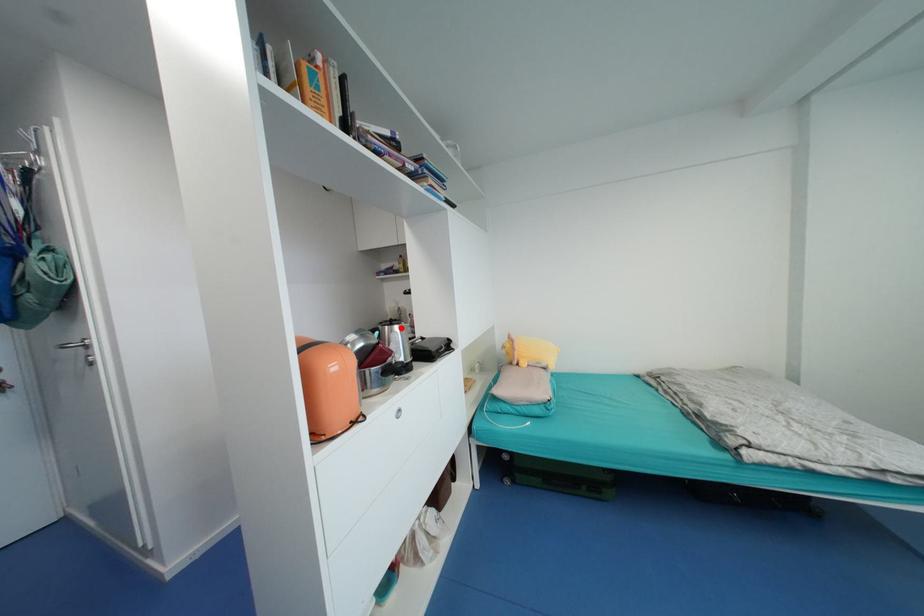
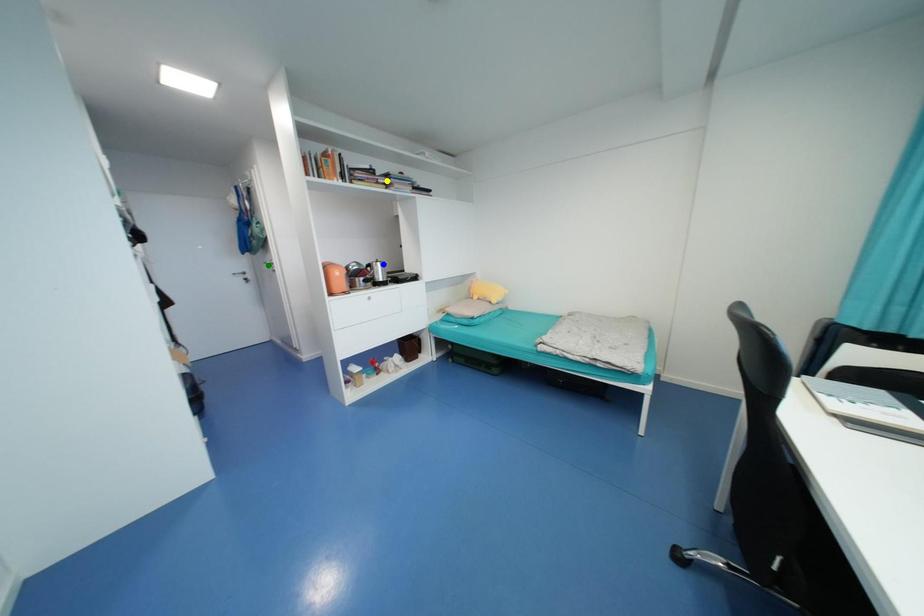
Question: I am providing you with two images of the same scene from different viewpoints. A red point is marked on the first image. You are given multiple points on the second image. In image 2, which mark is for the same physical point as the one in image 1?

Choices:
 (A) yellow point
 (B) green point
 (C) blue point

Answer: (C)